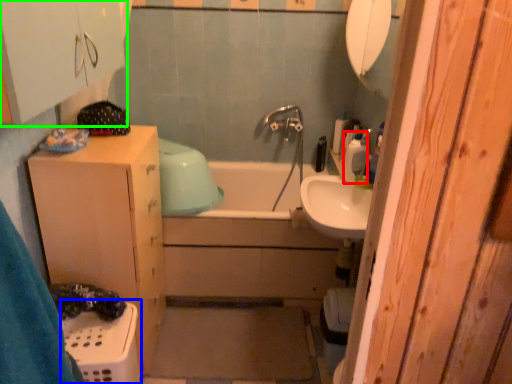
Question: Which object is positioned farthest from soap dispenser (highlighted by a red box)? Select from laundry basket (highlighted by a blue box) and cabinetry (highlighted by a green box).

Choices:
 (A) laundry basket
 (B) cabinetry

Answer: (A)